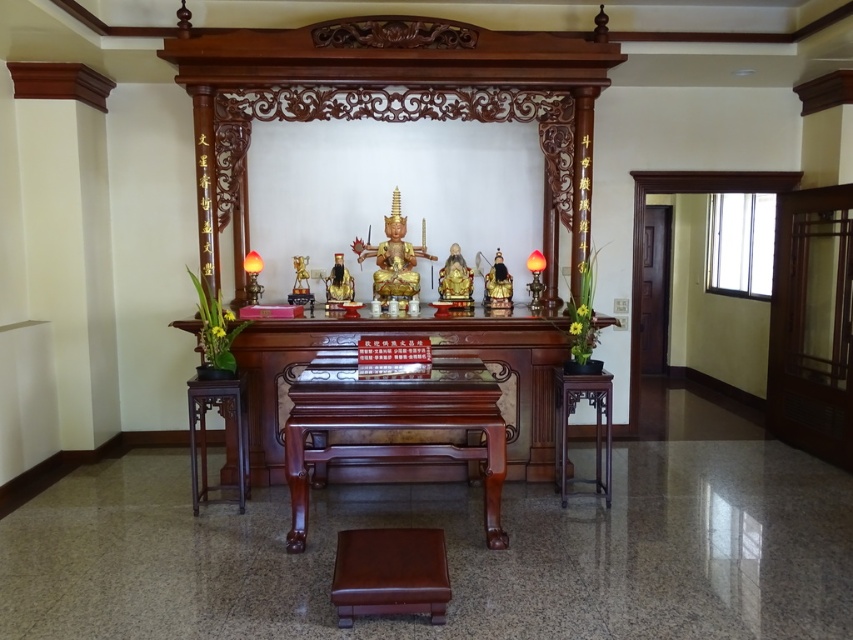
You are standing in front of the altar and need to place a small offering on the rectangular wooden table with a glass top. Where should you position the brown polished wood stool at lower left relative to the table to ensure it doesn not block access to the table?

The brown polished wood stool at lower left should be placed away from the rectangular wooden table with a glass top to avoid blocking access. Since the stool is located at point (x=206, y=433), positioning it further back or to the side would keep the path clear.

You are standing in front of the altar and want to place a ceremonial offering on the exact center of the polished dark wood altar at center. Given that the point marked at coordinates [433,355] represents the center of the altar, where should you aim to place the offering?

You should aim to place the offering at the coordinates [433,355], as this point marks the exact center of the polished dark wood altar at center.